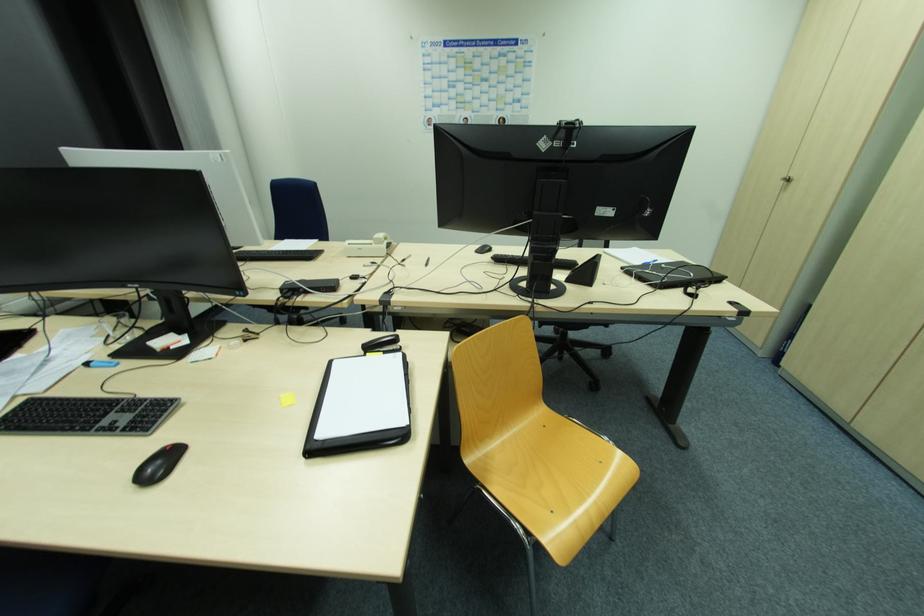
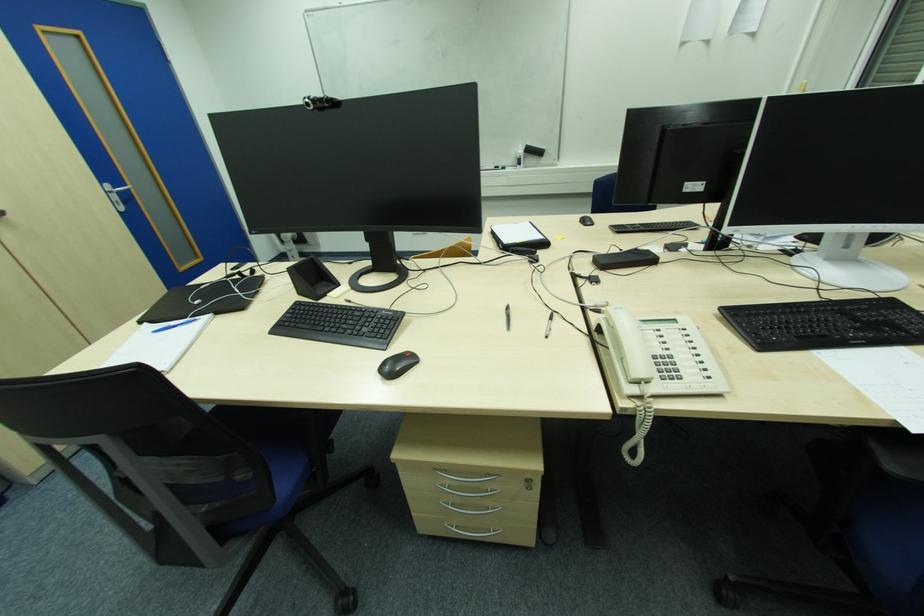
Locate, in the second image, the point that corresponds to [660,262] in the first image.

(156, 333)